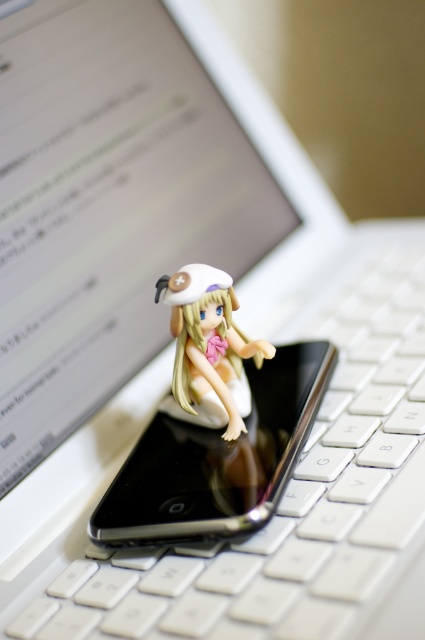
Can you confirm if black glossy smartphone at center is bigger than matte white figurine at center?

Indeed, black glossy smartphone at center has a larger size compared to matte white figurine at center.

Which is above, black glossy smartphone at center or matte white figurine at center?

matte white figurine at center is higher up.

Is point (280, 416) positioned after point (234, 348)?

Yes, it is behind point (234, 348).

Locate an element on the screen. black glossy smartphone at center is located at coordinates (218, 460).